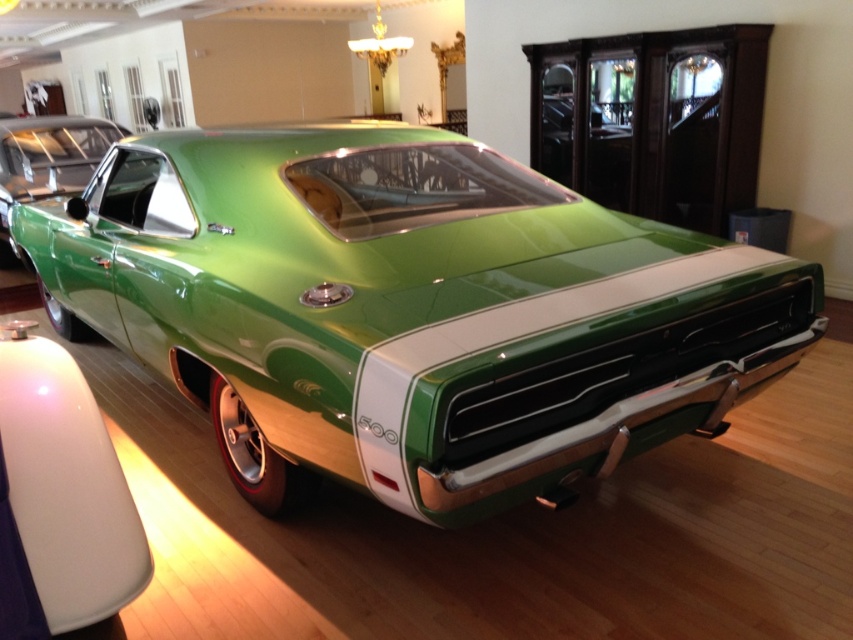
Between point (648, 244) and point (28, 172), which one is positioned behind?

Positioned behind is point (28, 172).

Is point (410, 269) more distant than point (86, 164)?

No, it is in front of (86, 164).

Does point (438, 492) come in front of point (102, 128)?

Yes, it is in front of point (102, 128).

Where is `green glossy muscle car at center`? This screenshot has width=853, height=640. green glossy muscle car at center is located at coordinates (408, 310).